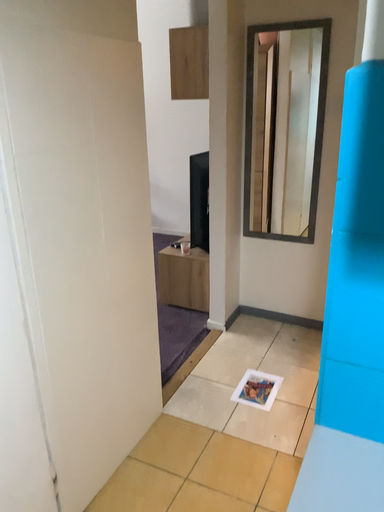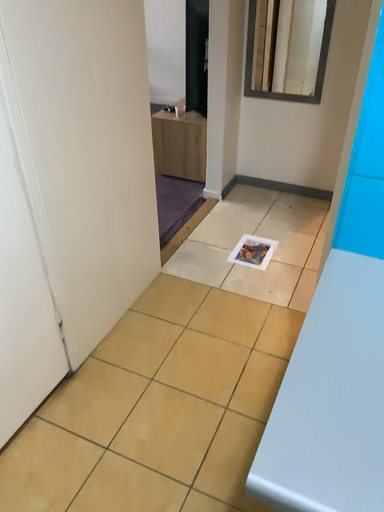
Question: How did the camera likely rotate when shooting the video?

Choices:
 (A) rotated downward
 (B) rotated upward

Answer: (A)